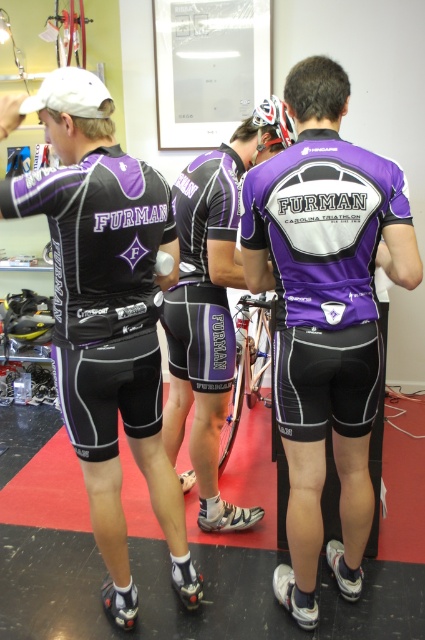
You are a photographer positioned to capture a group shot of the athletes. The purple matte shorts at center and the silver metallic bicycle at center are both in the frame. Which object is closer to the camera?

The purple matte shorts at center is in front of the silver metallic bicycle at center, so it is closer to the camera.

You are a photographer trying to capture a photo of the purple matte tri suit at center and the silver metallic bicycle at center. Since you want to ensure both are in focus, you need to know which object is taller. Can you tell me which one is taller?

The purple matte tri suit at center is much taller than the silver metallic bicycle at center, so you should adjust your camera settings to focus on the taller object first.

You are a photographer at the triathlon event. You need to capture a clear photo of the silver metallic bicycle at center without the purple matte shorts at center blocking it. Is this possible given their current positions?

The purple matte shorts at center is positioned over silver metallic bicycle at center, so it is currently blocking the bicycle. To capture a clear photo of the silver metallic bicycle at center without obstruction, you would need to adjust the angle or move the shorts out of the way.